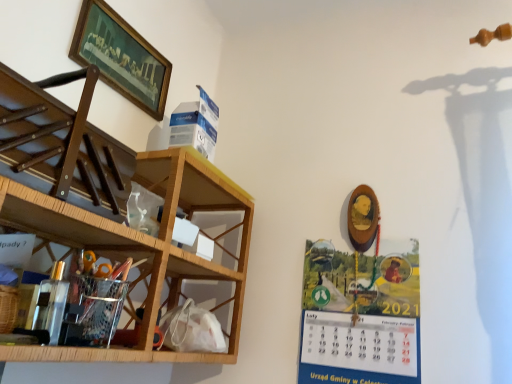
The height and width of the screenshot is (384, 512). Describe the element at coordinates (86, 248) in the screenshot. I see `metallic silver organizer at lower left, the third shelf from the top` at that location.

The image size is (512, 384). What do you see at coordinates (121, 57) in the screenshot? I see `wooden framed painting at upper left` at bounding box center [121, 57].

Identify the location of wooden at left, the 3th shelf positioned from the bottom. (62, 146).

I want to click on wooden at left, the second shelf in the bottom-to-top sequence, so click(109, 205).

Locate an element on the screen. The height and width of the screenshot is (384, 512). metallic silver organizer at lower left, which is counted as the first shelf, starting from the bottom is located at coordinates (86, 248).

Can you confirm if wooden at left, the 2th shelf from the top, is shorter than metallic calendar at right?

Incorrect, the height of wooden at left, the 2th shelf from the top, does not fall short of that of metallic calendar at right.

Is wooden at left, the 2th shelf from the top, looking in the opposite direction of metallic calendar at right?

No, wooden at left, the 2th shelf from the top, is not facing the opposite direction of metallic calendar at right.

From a real-world perspective, which is physically below, wooden at left, the 2th shelf from the top, or metallic calendar at right?

In real-world perspective, metallic calendar at right is lower.

Is wooden at left, the 2th shelf from the top, oriented away from wooden at left, placed as the 1th shelf when sorted from top to bottom?

Correct, wooden at left, the 2th shelf from the top, is looking away from wooden at left, placed as the 1th shelf when sorted from top to bottom.

Is wooden at left, the 2th shelf from the top, inside the boundaries of wooden at left, the 3th shelf positioned from the bottom, or outside?

wooden at left, the 2th shelf from the top, is outside wooden at left, the 3th shelf positioned from the bottom.

From the picture: Which object is further away from the camera taking this photo, wooden at left, the 2th shelf from the top, or wooden at left, placed as the 1th shelf when sorted from top to bottom?

wooden at left, placed as the 1th shelf when sorted from top to bottom.

Considering the sizes of wooden at left, the second shelf in the bottom-to-top sequence, and wooden at left, placed as the 1th shelf when sorted from top to bottom, in the image, is wooden at left, the second shelf in the bottom-to-top sequence, taller or shorter than wooden at left, placed as the 1th shelf when sorted from top to bottom,?

In the image, wooden at left, the second shelf in the bottom-to-top sequence, appears to be taller than wooden at left, placed as the 1th shelf when sorted from top to bottom.

What's the angular difference between wooden at left, placed as the 1th shelf when sorted from top to bottom, and metallic silver organizer at lower left, which is counted as the first shelf, starting from the bottom,'s facing directions?

The angle between the facing direction of wooden at left, placed as the 1th shelf when sorted from top to bottom, and the facing direction of metallic silver organizer at lower left, which is counted as the first shelf, starting from the bottom, is 0.000127 degrees.

Does wooden at left, the 3th shelf positioned from the bottom, have a larger size compared to metallic silver organizer at lower left, the third shelf from the top?

Yes, wooden at left, the 3th shelf positioned from the bottom, is bigger than metallic silver organizer at lower left, the third shelf from the top.

Considering the positions of objects wooden at left, placed as the 1th shelf when sorted from top to bottom, and metallic silver organizer at lower left, the third shelf from the top, in the image provided, who is more to the left, wooden at left, placed as the 1th shelf when sorted from top to bottom, or metallic silver organizer at lower left, the third shelf from the top,?

wooden at left, placed as the 1th shelf when sorted from top to bottom.

Considering the relative sizes of wooden at left, the 3th shelf positioned from the bottom, and metallic silver organizer at lower left, which is counted as the first shelf, starting from the bottom, in the image provided, is wooden at left, the 3th shelf positioned from the bottom, taller than metallic silver organizer at lower left, which is counted as the first shelf, starting from the bottom,?

Yes, wooden at left, the 3th shelf positioned from the bottom, is taller than metallic silver organizer at lower left, which is counted as the first shelf, starting from the bottom.

Is point (412, 363) farther from camera compared to point (154, 268)?

Yes, point (412, 363) is farther from viewer.

Between metallic calendar at right and metallic silver organizer at lower left, which is counted as the first shelf, starting from the bottom, which one appears on the right side from the viewer's perspective?

From the viewer's perspective, metallic calendar at right appears more on the right side.

Which of these two, metallic calendar at right or metallic silver organizer at lower left, which is counted as the first shelf, starting from the bottom, is smaller?

With smaller size is metallic calendar at right.

Is metallic calendar at right taller than metallic silver organizer at lower left, the third shelf from the top?

Correct, metallic calendar at right is much taller as metallic silver organizer at lower left, the third shelf from the top.

From the image's perspective, would you say wooden at left, the 3th shelf positioned from the bottom, is shown under metallic calendar at right?

No, from the image's perspective, wooden at left, the 3th shelf positioned from the bottom, is not beneath metallic calendar at right.

Which is nearer, (x=96, y=207) or (x=353, y=309)?

Point (x=96, y=207) appears to be closer to the viewer than point (x=353, y=309).

What's the angular difference between wooden at left, placed as the 1th shelf when sorted from top to bottom, and metallic calendar at right's facing directions?

There is a 88.7-degree angle between the facing directions of wooden at left, placed as the 1th shelf when sorted from top to bottom, and metallic calendar at right.

Is wooden at left, placed as the 1th shelf when sorted from top to bottom, touching metallic calendar at right?

No, wooden at left, placed as the 1th shelf when sorted from top to bottom, is not touching metallic calendar at right.

Considering the sizes of objects wooden framed painting at upper left and metallic calendar at right in the image provided, who is thinner, wooden framed painting at upper left or metallic calendar at right?

Thinner between the two is metallic calendar at right.

In order to click on picture frame above the metallic calendar at right (from the image's perspective) in this screenshot , I will do `click(121, 57)`.

Which of these two, wooden framed painting at upper left or metallic calendar at right, stands shorter?

wooden framed painting at upper left.

Are wooden framed painting at upper left and metallic calendar at right beside each other?

wooden framed painting at upper left is not next to metallic calendar at right, and they're not touching.

Is point (9, 211) closer to viewer compared to point (101, 179)?

Yes.

In terms of height, does metallic silver organizer at lower left, the third shelf from the top, look taller or shorter compared to wooden at left, the second shelf in the bottom-to-top sequence?

Considering their sizes, metallic silver organizer at lower left, the third shelf from the top, has less height than wooden at left, the second shelf in the bottom-to-top sequence.

Considering the relative sizes of metallic silver organizer at lower left, which is counted as the first shelf, starting from the bottom, and wooden at left, the second shelf in the bottom-to-top sequence, in the image provided, is metallic silver organizer at lower left, which is counted as the first shelf, starting from the bottom, thinner than wooden at left, the second shelf in the bottom-to-top sequence,?

Correct, the width of metallic silver organizer at lower left, which is counted as the first shelf, starting from the bottom, is less than that of wooden at left, the second shelf in the bottom-to-top sequence.

Would you say metallic silver organizer at lower left, which is counted as the first shelf, starting from the bottom, is outside wooden at left, the second shelf in the bottom-to-top sequence?

No, metallic silver organizer at lower left, which is counted as the first shelf, starting from the bottom, is inside or overlapping with wooden at left, the second shelf in the bottom-to-top sequence.

The image size is (512, 384). I want to click on poster below the wooden at left, the 2th shelf from the top (from a real-world perspective), so click(360, 315).

Identify the location of shelf above the wooden at left, the second shelf in the bottom-to-top sequence (from a real-world perspective). (62, 146).

Based on their spatial positions, is wooden framed painting at upper left or wooden at left, placed as the 1th shelf when sorted from top to bottom, further from metallic silver organizer at lower left, the third shelf from the top?

The object further to metallic silver organizer at lower left, the third shelf from the top, is wooden framed painting at upper left.

From the image, which object appears to be nearer to wooden at left, the second shelf in the bottom-to-top sequence, metallic silver organizer at lower left, the third shelf from the top, or wooden framed painting at upper left?

metallic silver organizer at lower left, the third shelf from the top, is closer to wooden at left, the second shelf in the bottom-to-top sequence.

From the image, which object appears to be farther from wooden at left, the second shelf in the bottom-to-top sequence, wooden framed painting at upper left or metallic calendar at right?

metallic calendar at right.

Looking at the image, which one is located closer to wooden framed painting at upper left, wooden at left, the second shelf in the bottom-to-top sequence, or metallic silver organizer at lower left, which is counted as the first shelf, starting from the bottom?

wooden at left, the second shelf in the bottom-to-top sequence, is closer to wooden framed painting at upper left.

From the image, which object appears to be farther from wooden at left, the second shelf in the bottom-to-top sequence, metallic calendar at right or wooden framed painting at upper left?

metallic calendar at right.

From the image, which object appears to be nearer to metallic silver organizer at lower left, the third shelf from the top, wooden at left, the second shelf in the bottom-to-top sequence, or wooden at left, placed as the 1th shelf when sorted from top to bottom?

wooden at left, the second shelf in the bottom-to-top sequence, is closer to metallic silver organizer at lower left, the third shelf from the top.

Considering their positions, is metallic silver organizer at lower left, which is counted as the first shelf, starting from the bottom, positioned further to wooden at left, placed as the 1th shelf when sorted from top to bottom, than wooden framed painting at upper left?

Among the two, wooden framed painting at upper left is located further to wooden at left, placed as the 1th shelf when sorted from top to bottom.

From the image, which object appears to be farther from wooden framed painting at upper left, wooden at left, the 3th shelf positioned from the bottom, or metallic silver organizer at lower left, the third shelf from the top?

Based on the image, metallic silver organizer at lower left, the third shelf from the top, appears to be further to wooden framed painting at upper left.

Identify the location of picture frame between wooden at left, the 3th shelf positioned from the bottom, and metallic calendar at right. This screenshot has width=512, height=384. (121, 57).

This screenshot has height=384, width=512. I want to click on shelf between wooden at left, the 3th shelf positioned from the bottom, and metallic silver organizer at lower left, the third shelf from the top, in the up-down direction, so click(x=109, y=205).

This screenshot has width=512, height=384. I want to click on shelf between metallic silver organizer at lower left, which is counted as the first shelf, starting from the bottom, and metallic calendar at right, so click(109, 205).